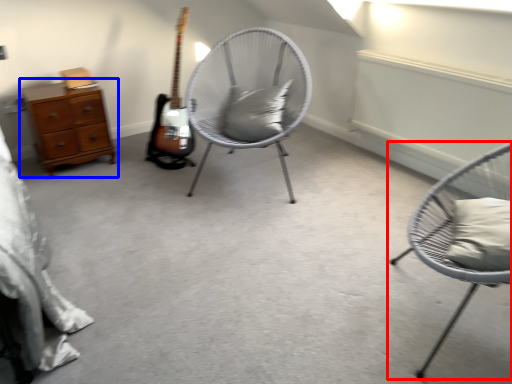
Question: Which point is closer to the camera, chair (highlighted by a red box) or chest of drawers (highlighted by a blue box)?

Choices:
 (A) chair
 (B) chest of drawers

Answer: (A)